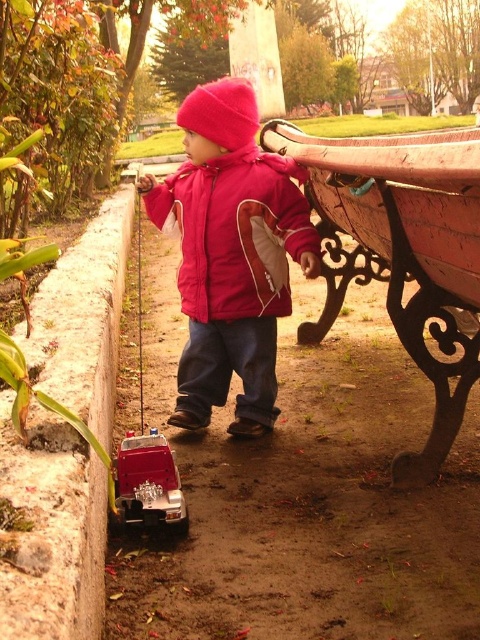
You are a photographer setting up a shot of the matte pink jacket at center and the rustic wood bench at right. Which object should you zoom in on to capture more detail without moving the camera?

The matte pink jacket at center has a lesser width compared to rustic wood bench at right, so you should zoom in on the matte pink jacket at center to capture more detail without moving the camera because it is smaller and requires closer focus.